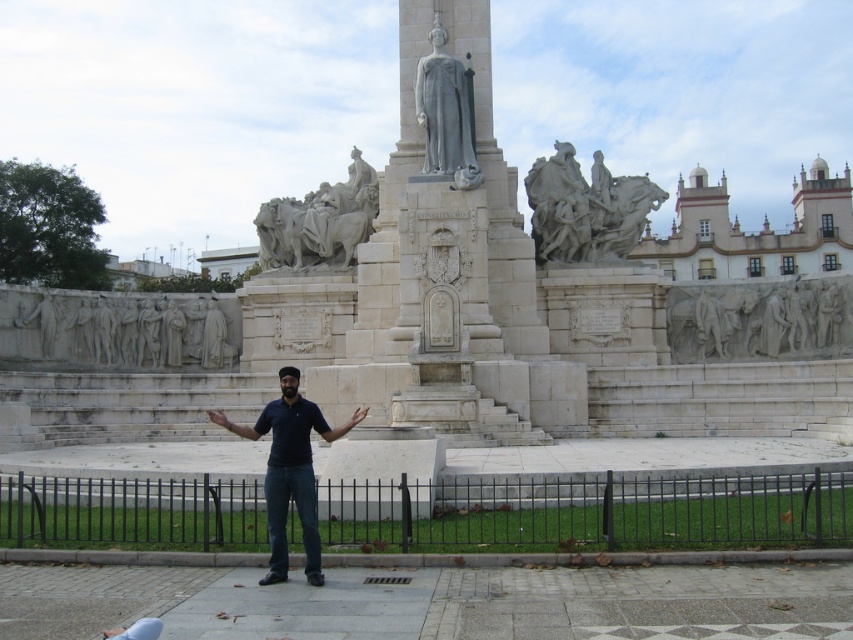
Question: Considering the relative positions of dark blue shirt at center and white marble statues at upper center in the image provided, where is dark blue shirt at center located with respect to white marble statues at upper center?

Choices:
 (A) above
 (B) below

Answer: (B)

Question: Which object is closer to the camera taking this photo?

Choices:
 (A) white marble statue at center
 (B) dark blue shirt at center
 (C) white marble statue at upper center
 (D) brown leather hand at center

Answer: (B)

Question: Does white stone relief at center appear under light skin hand at center?

Choices:
 (A) yes
 (B) no

Answer: (B)

Question: Considering the relative positions of white marble statue at upper center and white marble statues at upper center in the image provided, where is white marble statue at upper center located with respect to white marble statues at upper center?

Choices:
 (A) above
 (B) below

Answer: (A)

Question: Considering the real-world distances, which object is closest to the white marble statue at center?

Choices:
 (A) light skin hand at center
 (B) white stone relief at center
 (C) dark blue shirt at center
 (D) white marble statue at upper center

Answer: (D)

Question: Among these objects, which one is farthest from the camera?

Choices:
 (A) white stone relief at center
 (B) white marble statue at upper center

Answer: (B)